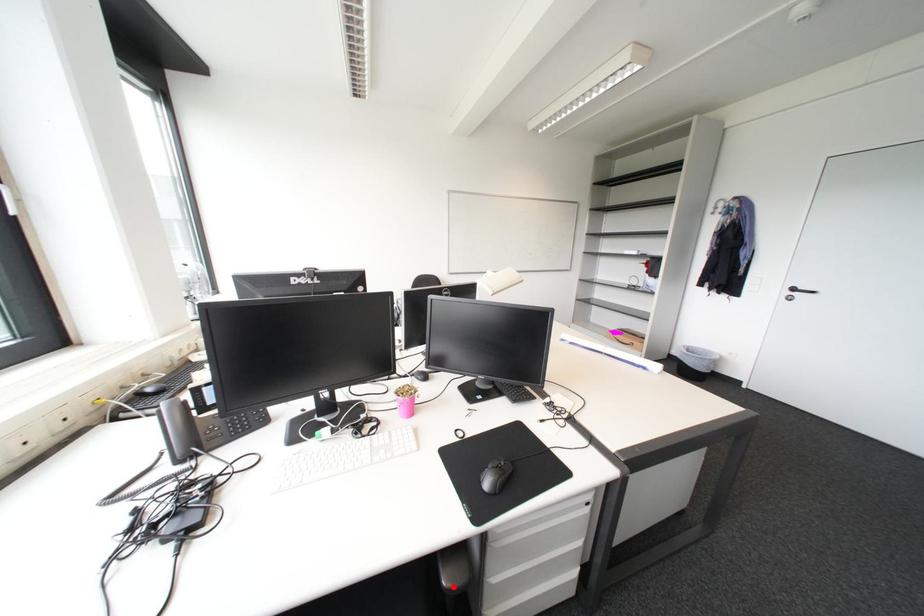
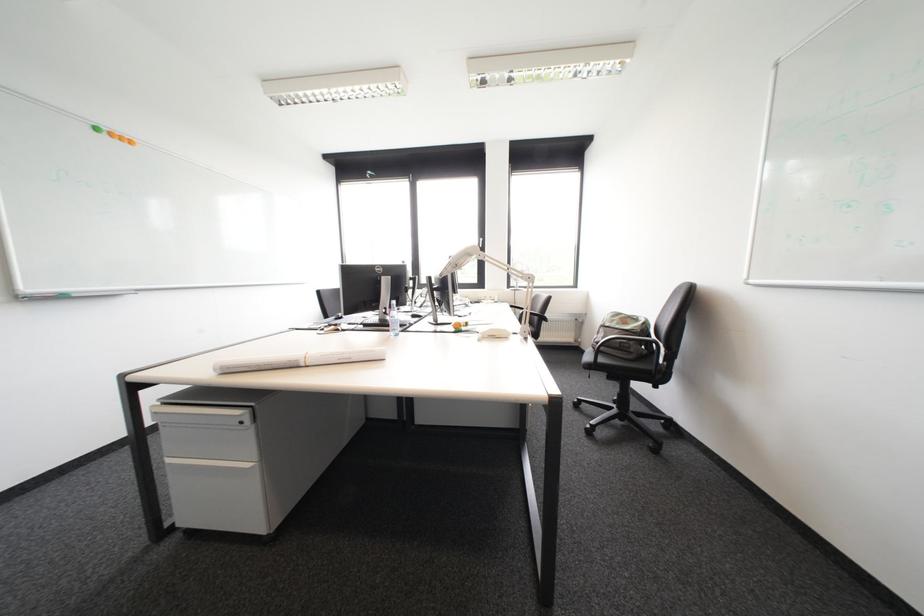
Question: I am providing you with two images of the same scene from different viewpoints. A red point is marked on the first image. Is the red point's position out of view in image 2?

Choices:
 (A) Yes
 (B) No

Answer: (A)